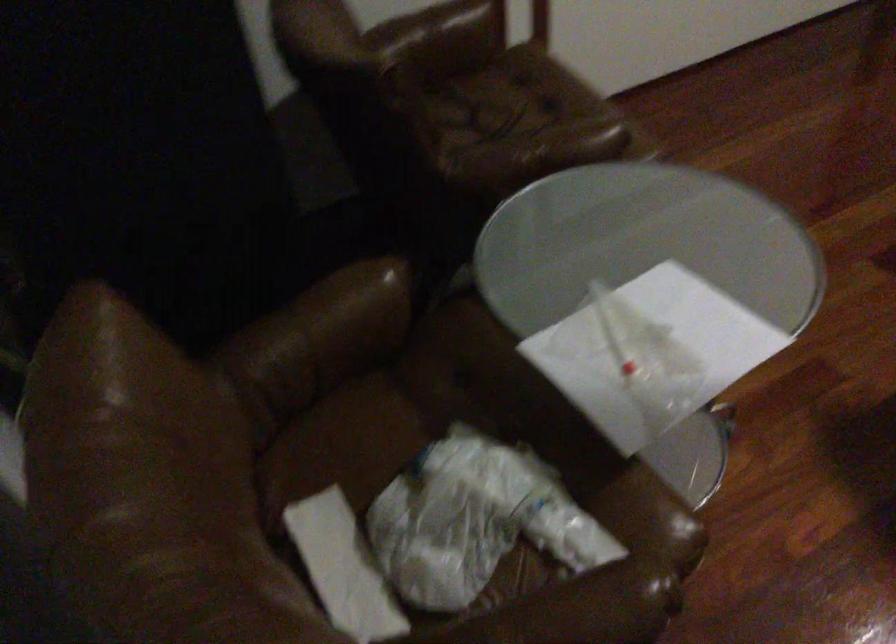
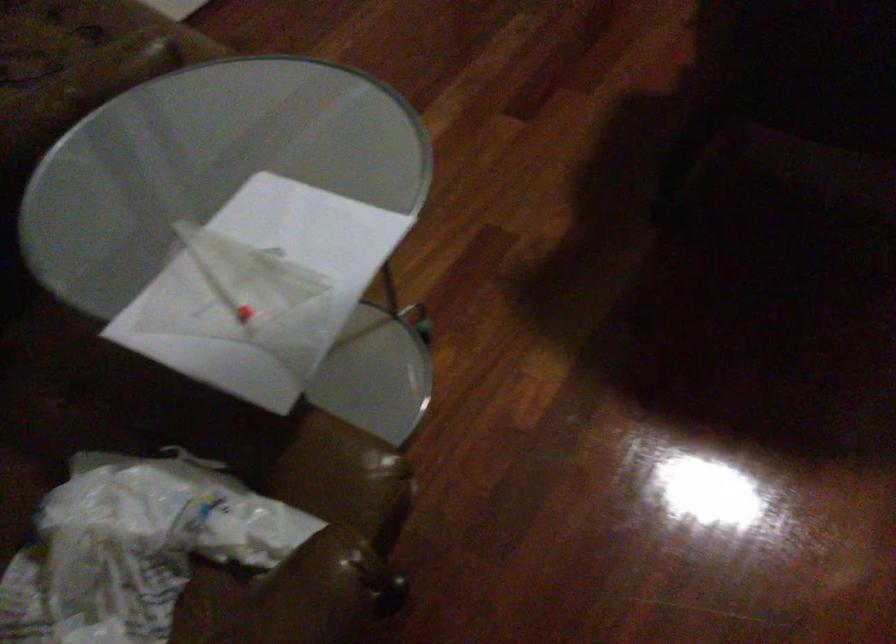
Where in the second image is the point corresponding to the point at 492,507 from the first image?

(134, 547)